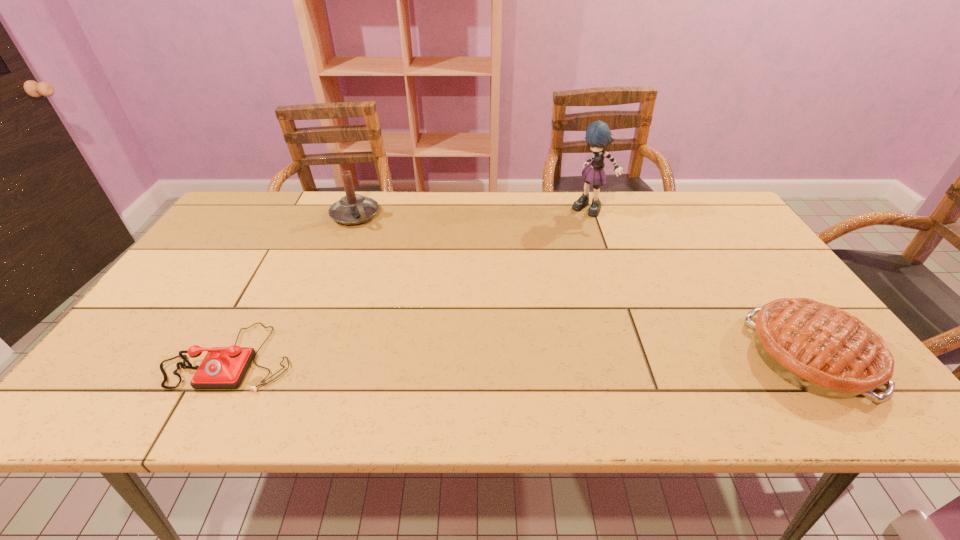
Locate an element on the screen. This screenshot has height=540, width=960. telephone is located at coordinates (223, 367).

Image resolution: width=960 pixels, height=540 pixels. I want to click on pie, so click(821, 349).

Image resolution: width=960 pixels, height=540 pixels. I want to click on the third tallest object, so click(x=821, y=349).

What are the coordinates of `candle` in the screenshot? It's located at (352, 209).

The image size is (960, 540). In order to click on the tallest object in this screenshot , I will do `click(598, 135)`.

The width and height of the screenshot is (960, 540). Identify the location of the second object from right to left. (598, 135).

You are a GUI agent. You are given a task and a screenshot of the screen. Output one action in this format:
    pyautogui.click(x=<x>, y=<y>)
    Task: Click on the free space located on the left of the pie
    This screenshot has height=540, width=960.
    Given the screenshot: What is the action you would take?
    pyautogui.click(x=690, y=356)

Locate an element on the screen. This screenshot has height=540, width=960. blank space located on the side of the candle with the handle loop is located at coordinates (389, 265).

Where is `blank space located on the side of the candle with the handle loop`? blank space located on the side of the candle with the handle loop is located at coordinates (395, 273).

This screenshot has width=960, height=540. What are the coordinates of `vacant region located 0.240m on the side of the candle with the handle loop` in the screenshot? It's located at (394, 271).